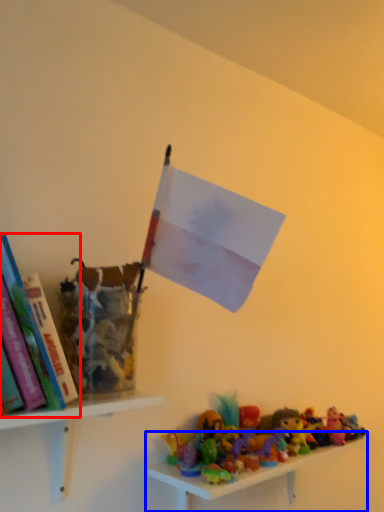
Question: Which object is further to the camera taking this photo, book (highlighted by a red box) or shelf (highlighted by a blue box)?

Choices:
 (A) book
 (B) shelf

Answer: (B)